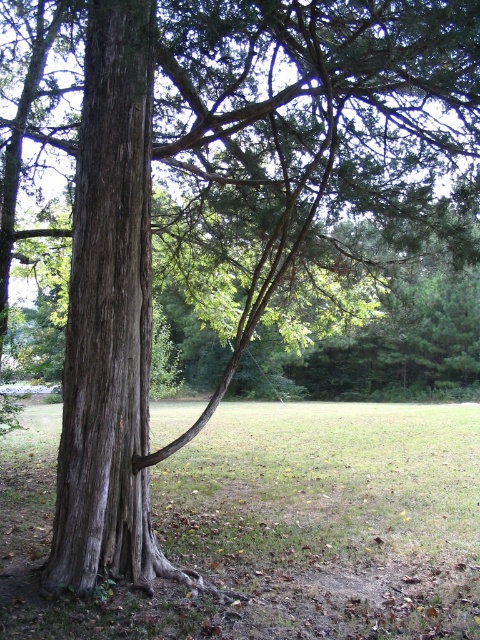
Question: Can you confirm if green grass at lower center is bigger than grayish-brown bark tree trunk at left?

Choices:
 (A) yes
 (B) no

Answer: (A)

Question: Is the position of green grass at lower center less distant than that of grayish-brown bark tree trunk at left?

Choices:
 (A) no
 (B) yes

Answer: (B)

Question: Among these objects, which one is nearest to the camera?

Choices:
 (A) grayish-brown bark tree trunk at left
 (B) green grass at lower center

Answer: (B)

Question: Which of the following is the closest to the observer?

Choices:
 (A) (275, 438)
 (B) (91, 355)

Answer: (B)

Question: Does green grass at lower center have a larger size compared to grayish-brown bark tree trunk at left?

Choices:
 (A) yes
 (B) no

Answer: (A)